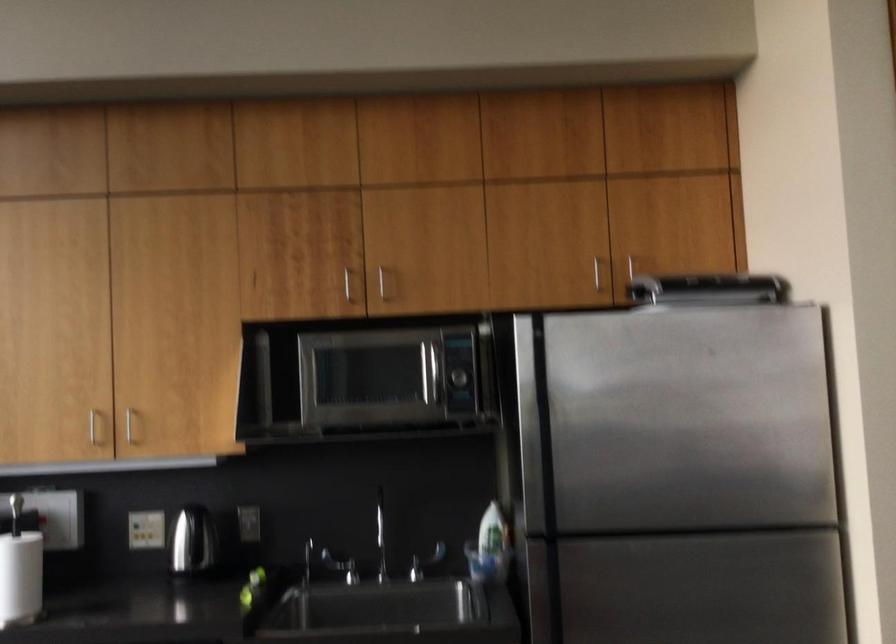
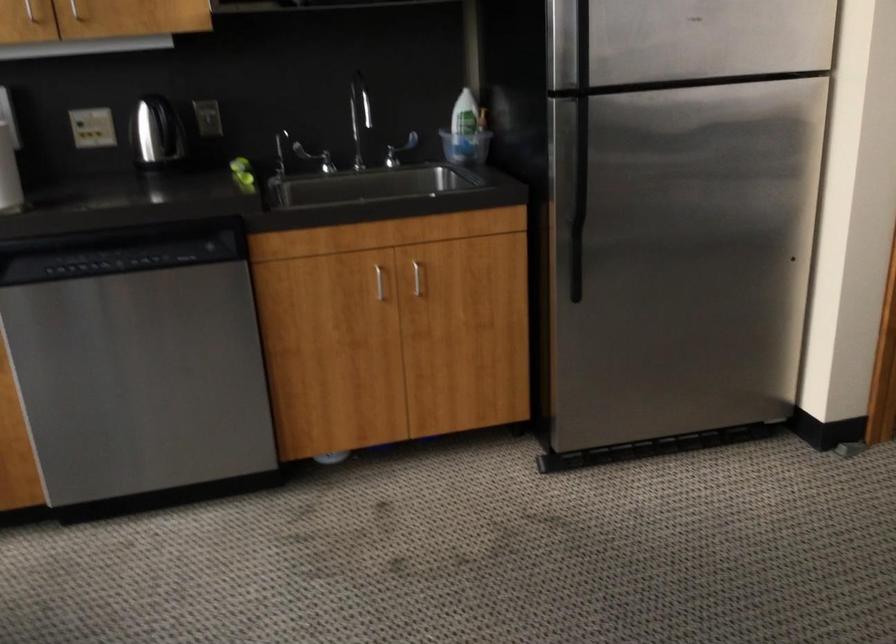
Question: Based on the continuous images, in which direction is the camera rotating? Reply with the corresponding letter.

Choices:
 (A) Left
 (B) Right
 (C) Up
 (D) Down

Answer: (D)